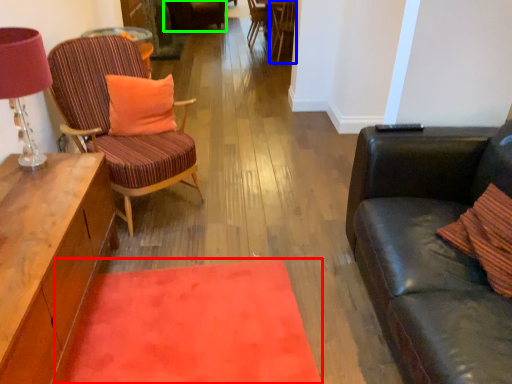
Question: Considering the real-world distances, which object is closest to mat (highlighted by a red box)? chair (highlighted by a blue box) or chair (highlighted by a green box).

Choices:
 (A) chair
 (B) chair

Answer: (A)